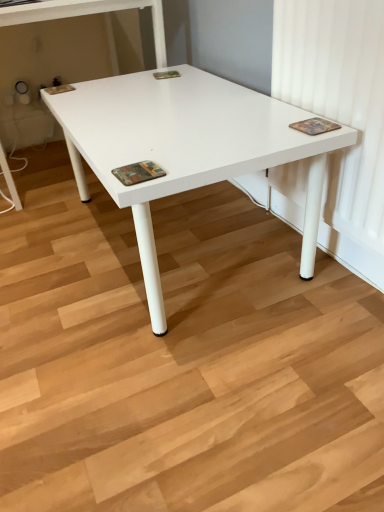
In order to click on white glossy computer desk at center in this screenshot , I will do `click(87, 14)`.

Describe the element at coordinates (87, 14) in the screenshot. I see `white glossy computer desk at center` at that location.

Where is `white glossy computer desk at center`? The height and width of the screenshot is (512, 384). white glossy computer desk at center is located at coordinates (87, 14).